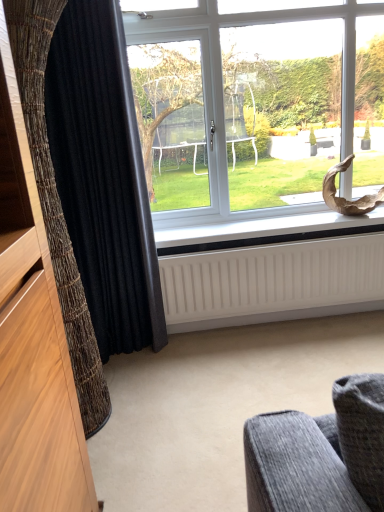
Question: From the image's perspective, is white ribbed radiator at lower center under black textured curtain at left, which appears as the second curtain when viewed from the front?

Choices:
 (A) yes
 (B) no

Answer: (A)

Question: Considering the relative positions of white ribbed radiator at lower center and black textured curtain at left, which appears as the second curtain when viewed from the front, in the image provided, is white ribbed radiator at lower center to the right of black textured curtain at left, which appears as the second curtain when viewed from the front, from the viewer's perspective?

Choices:
 (A) no
 (B) yes

Answer: (B)

Question: Is white ribbed radiator at lower center positioned in front of black textured curtain at left, which appears as the second curtain when viewed from the front?

Choices:
 (A) yes
 (B) no

Answer: (B)

Question: Considering the relative sizes of white ribbed radiator at lower center and black textured curtain at left, the first curtain positioned from the back, in the image provided, is white ribbed radiator at lower center taller than black textured curtain at left, the first curtain positioned from the back,?

Choices:
 (A) no
 (B) yes

Answer: (A)

Question: Can you confirm if white ribbed radiator at lower center is bigger than black textured curtain at left, the first curtain positioned from the back?

Choices:
 (A) yes
 (B) no

Answer: (B)

Question: Is white ribbed radiator at lower center in contact with black textured curtain at left, the first curtain positioned from the back?

Choices:
 (A) yes
 (B) no

Answer: (B)

Question: Is black textured curtain at left, the first curtain positioned from the back, to the right of white matte radiator at lower center from the viewer's perspective?

Choices:
 (A) yes
 (B) no

Answer: (B)

Question: From a real-world perspective, is black textured curtain at left, which appears as the second curtain when viewed from the front, positioned over white matte radiator at lower center based on gravity?

Choices:
 (A) yes
 (B) no

Answer: (A)

Question: From the image's perspective, does black textured curtain at left, which appears as the second curtain when viewed from the front, appear higher than white matte radiator at lower center?

Choices:
 (A) no
 (B) yes

Answer: (B)

Question: Is black textured curtain at left, which appears as the second curtain when viewed from the front, thinner than white matte radiator at lower center?

Choices:
 (A) no
 (B) yes

Answer: (B)

Question: Is black textured curtain at left, the first curtain positioned from the back, facing away from white matte radiator at lower center?

Choices:
 (A) yes
 (B) no

Answer: (B)

Question: Does black textured curtain at left, which appears as the second curtain when viewed from the front, appear on the left side of white matte radiator at lower center?

Choices:
 (A) no
 (B) yes

Answer: (B)

Question: Is white matte radiator at lower center not inside black textured curtain at left, which is counted as the first curtain, starting from the front?

Choices:
 (A) no
 (B) yes

Answer: (B)